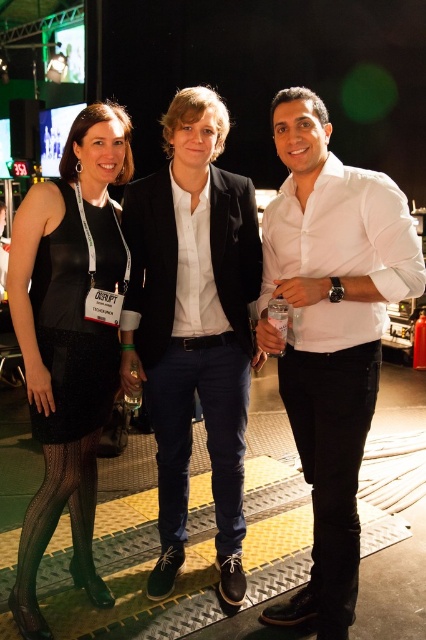
You are a photographer at the event and need to capture a photo of both the white smooth shirt at center and the black leather pants at right. Based on their positions, which one will appear closer to the camera in the photo?

The white smooth shirt at center will appear closer to the camera because it is positioned in front of the black leather pants at right.

You are an event photographer positioned at the back of the stage. You need to capture a photo of the white smooth shirt at center and the black leather pants at right. Based on their positions, which one is higher in the frame?

The white smooth shirt at center is above the black leather pants at right, so it will appear higher in the frame.